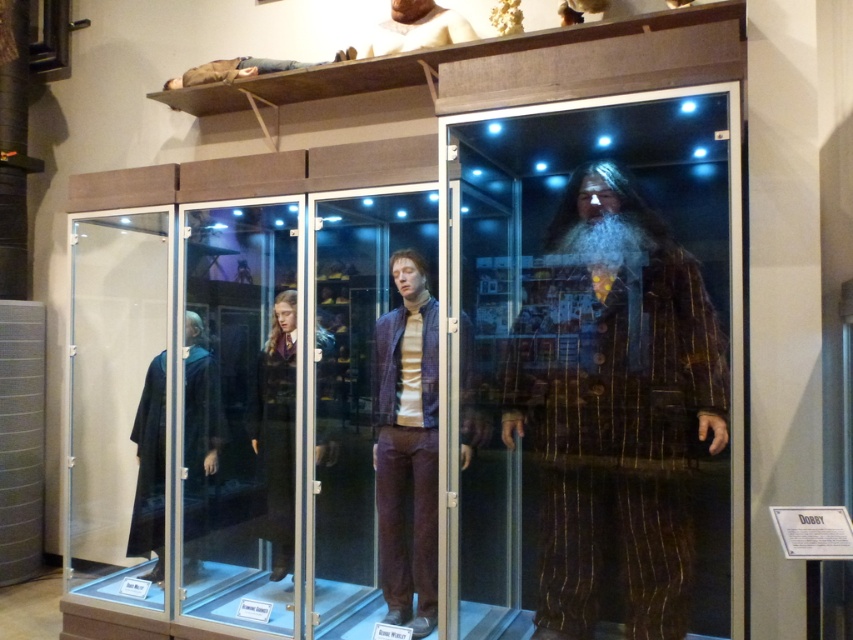
You are a curator preparing to adjust the display case. You need to place a 18 inch wide decorative plaque between the brown striped suit at center and the purple matte suit at center. Is there enough space between them to fit the plaque without moving the suits?

The brown striped suit at center and purple matte suit at center are 19.63 inches apart from each other. Since the plaque is 18 inches wide, there is enough space between them to fit the plaque without moving the suits.

You are a visitor standing in front of the display case. You notice two points marked on the glass surface. The first point is at coordinate point(550, 598) and the second is at point(421, 396). Which point do you think is closer to you?

Point(550, 598) is closer to the viewer than point(421, 396).

You are standing in front of the display case and want to take a photo of the two points mentioned. Which point, point (405, 317) or point (148, 387), will appear larger in your photo?

Point (405, 317) is closer to the camera than point (148, 387), so it will appear larger in the photo.